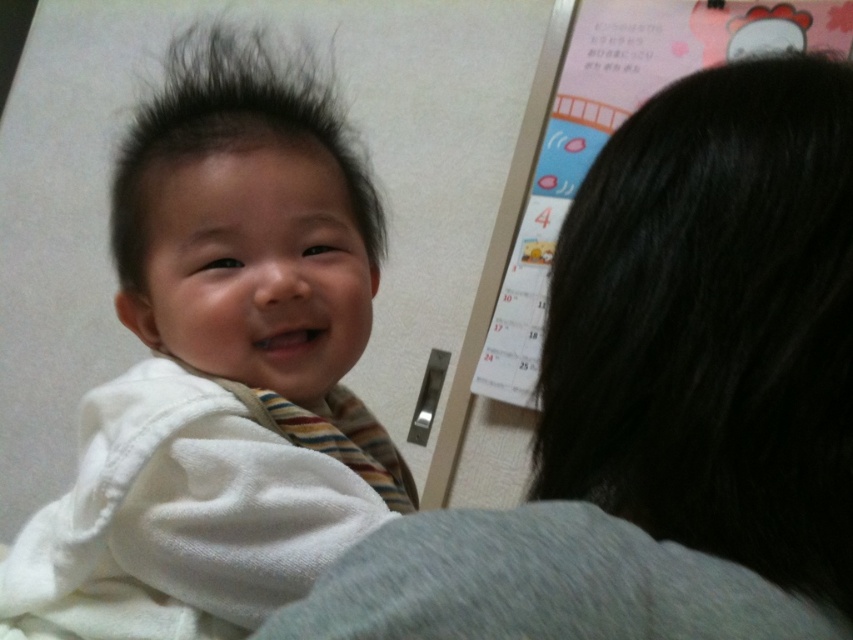
Question: Among these objects, which one is farthest from the camera?

Choices:
 (A) white soft fabric baby at center
 (B) gray fabric at upper left

Answer: (A)

Question: Which point appears farthest from the camera in this image?

Choices:
 (A) (128, 244)
 (B) (341, 156)
 (C) (734, 592)

Answer: (B)

Question: Can you confirm if gray fabric at upper left is positioned to the left of dark brown fuzzy hair at upper left?

Choices:
 (A) yes
 (B) no

Answer: (B)

Question: Which of the following is the closest to the observer?

Choices:
 (A) dark brown fuzzy hair at upper left
 (B) gray fabric at upper left
 (C) white soft fabric baby at center

Answer: (B)

Question: Can you confirm if white soft fabric baby at center is wider than dark brown fuzzy hair at upper left?

Choices:
 (A) yes
 (B) no

Answer: (B)

Question: Is white soft fabric baby at center to the right of dark brown fuzzy hair at upper left from the viewer's perspective?

Choices:
 (A) yes
 (B) no

Answer: (A)